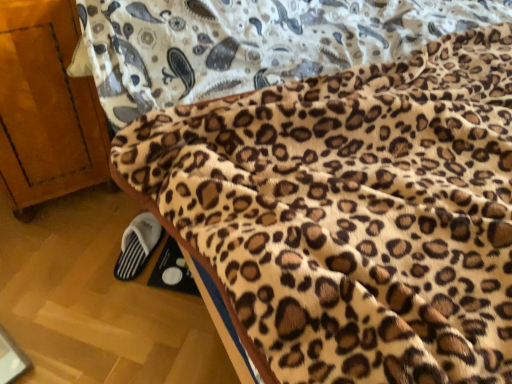
Question: From the image's perspective, is leopard print fleece blanket at lower right located above or below wooden cabinet at left?

Choices:
 (A) above
 (B) below

Answer: (B)

Question: In terms of size, does leopard print fleece blanket at lower right appear bigger or smaller than wooden cabinet at left?

Choices:
 (A) small
 (B) big

Answer: (A)

Question: Which object is positioned closest to the leopard print fleece blanket at lower right?

Choices:
 (A) wooden cabinet at left
 (B) white fabric slipper at lower left

Answer: (A)

Question: Based on their relative distances, which object is farther from the wooden cabinet at left?

Choices:
 (A) white fabric slipper at lower left
 (B) leopard print fleece blanket at lower right

Answer: (B)